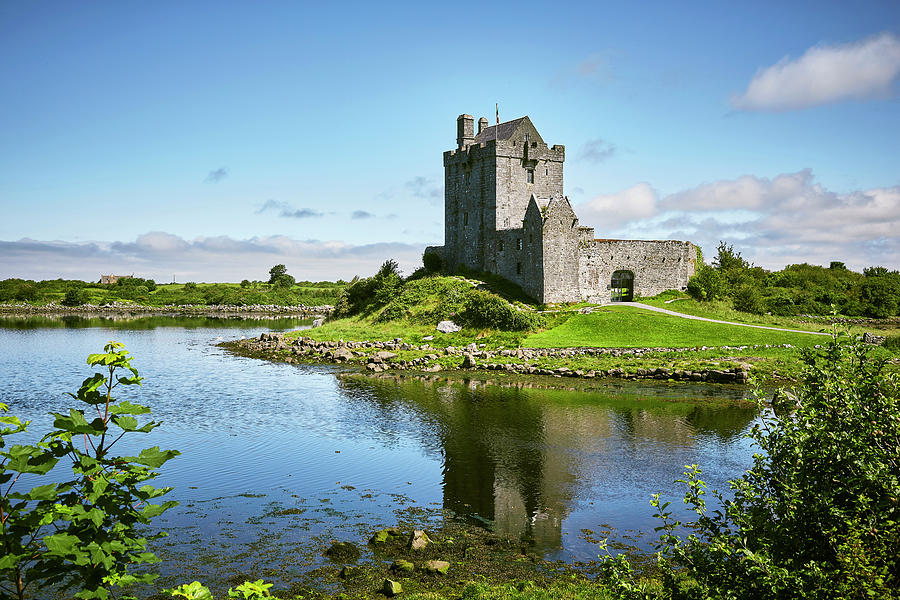
Image resolution: width=900 pixels, height=600 pixels. Identify the location of tall plant in bottom left of image. tap(96, 510).